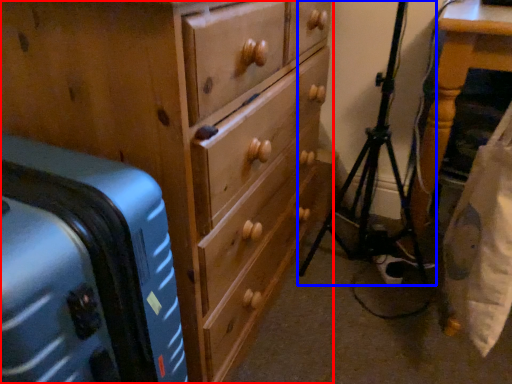
Question: Which point is further to the camera, chest of drawers (highlighted by a red box) or tripod (highlighted by a blue box)?

Choices:
 (A) chest of drawers
 (B) tripod

Answer: (B)